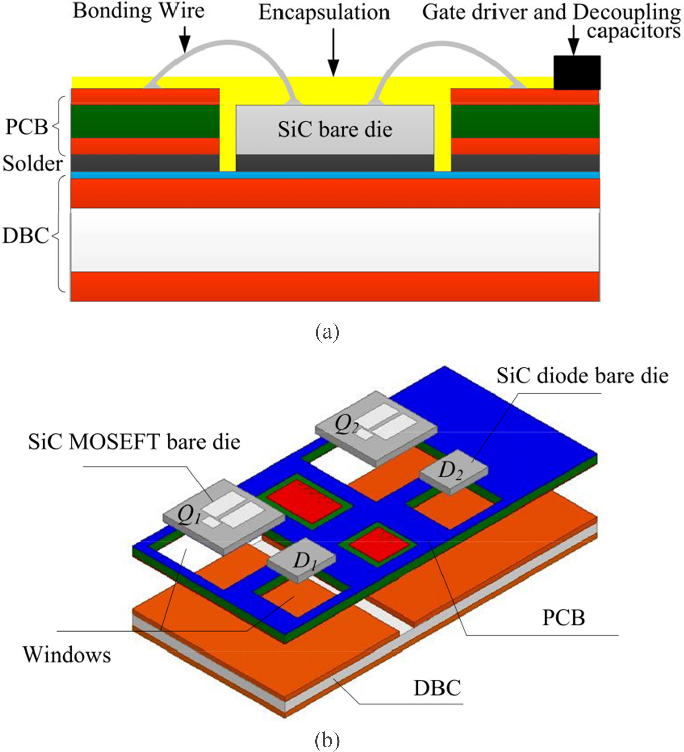
Locate an element on the screen. This screenshot has height=752, width=684. blue panel is located at coordinates (531, 484).